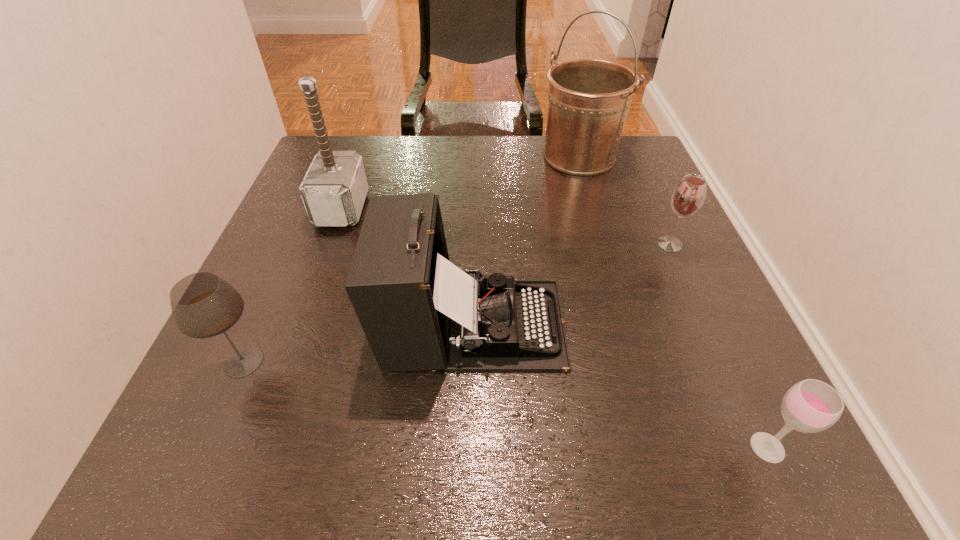
Where is `the fourth object from left to right`? Image resolution: width=960 pixels, height=540 pixels. the fourth object from left to right is located at coordinates (588, 99).

Find the location of a particular element. bucket is located at coordinates (588, 99).

Locate an element on the screen. This screenshot has height=540, width=960. the fifth nearest object is located at coordinates (334, 189).

Where is `the fifth shortest object`? the fifth shortest object is located at coordinates (334, 189).

Find the location of `typewriter`. typewriter is located at coordinates (419, 311).

Locate an element on the screen. The width and height of the screenshot is (960, 540). the third object from left to right is located at coordinates (419, 311).

You are a GUI agent. You are given a task and a screenshot of the screen. Output one action in this format:
    pyautogui.click(x=<x>, y=<y>)
    Task: Click on the second nearest wineglass
    The height and width of the screenshot is (540, 960).
    Given the screenshot: What is the action you would take?
    pyautogui.click(x=203, y=305)

Find the location of a particular element. This screenshot has height=540, width=960. the third farthest object is located at coordinates (688, 197).

At what (x,y) coordinates should I click in order to perform the action: click on the nearest wineglass. Please return your answer as a coordinate pair (x, y). Image resolution: width=960 pixels, height=540 pixels. Looking at the image, I should click on point(810,406).

Where is `vacant space situated 0.080m on the left of the bucket`? The width and height of the screenshot is (960, 540). vacant space situated 0.080m on the left of the bucket is located at coordinates (509, 157).